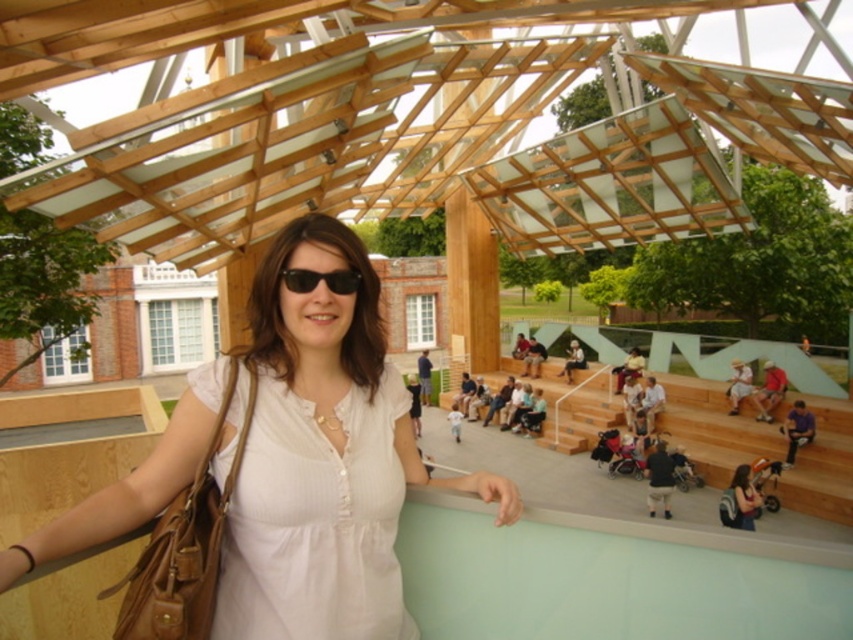
Question: Can you confirm if white matte dress at center is wider than black matte sunglasses at center?

Choices:
 (A) yes
 (B) no

Answer: (A)

Question: Can you confirm if white matte dress at center is positioned above black matte sunglasses at center?

Choices:
 (A) no
 (B) yes

Answer: (A)

Question: Which of the following is the farthest from the observer?

Choices:
 (A) (303, 289)
 (B) (726, 512)
 (C) (509, 518)

Answer: (B)

Question: Can you confirm if white matte dress at center is wider than matte brown backpack at lower right?

Choices:
 (A) yes
 (B) no

Answer: (A)

Question: Which of the following is the closest to the observer?

Choices:
 (A) black matte sunglasses at center
 (B) matte brown backpack at lower right

Answer: (A)

Question: Which is nearer to the matte brown backpack at lower right?

Choices:
 (A) white matte dress at center
 (B) black matte sunglasses at center

Answer: (A)